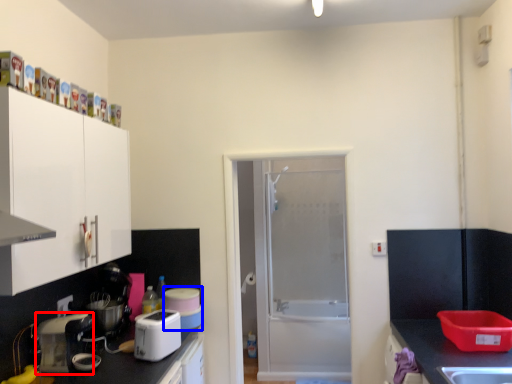
Question: Which of the following is the closest to the observer, kitchen appliance (highlighted by a red box) or appliance (highlighted by a blue box)?

Choices:
 (A) kitchen appliance
 (B) appliance

Answer: (A)